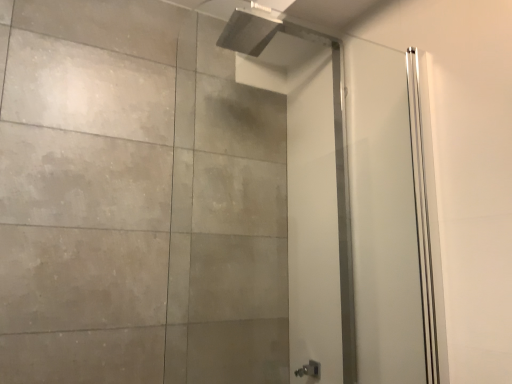
Image resolution: width=512 pixels, height=384 pixels. Describe the element at coordinates (308, 186) in the screenshot. I see `clear glass screen door at center` at that location.

Where is `clear glass screen door at center`? clear glass screen door at center is located at coordinates (308, 186).

Image resolution: width=512 pixels, height=384 pixels. What are the coordinates of `clear glass screen door at center` in the screenshot? It's located at (308, 186).